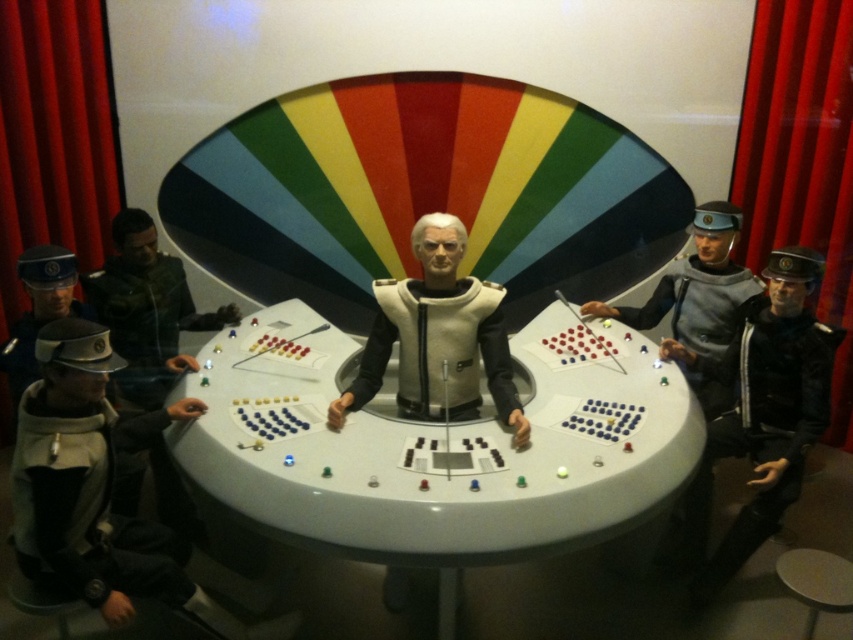
Between white plastic round table at center and metallic silver uniform at right, which one is positioned higher?

metallic silver uniform at right

Which is behind, point (448, 624) or point (724, 240)?

The point (724, 240) is more distant.

Which is in front, point (525, 476) or point (646, 307)?

Point (525, 476) is more forward.

I want to click on white plastic round table at center, so click(431, 451).

Can you confirm if light gray fabric jacket at lower left is positioned above black leather jacket at lower right?

No.

Is light gray fabric jacket at lower left smaller than black leather jacket at lower right?

Correct, light gray fabric jacket at lower left occupies less space than black leather jacket at lower right.

Is point (103, 468) positioned after point (814, 426)?

No, (103, 468) is closer to viewer.

Locate an element on the screen. This screenshot has width=853, height=640. light gray fabric jacket at lower left is located at coordinates (90, 481).

Is white matte astronaut at center taller than metallic silver uniform at right?

In fact, white matte astronaut at center may be shorter than metallic silver uniform at right.

Between white matte astronaut at center and metallic silver uniform at right, which one has less height?

Standing shorter between the two is white matte astronaut at center.

Locate an element on the screen. The width and height of the screenshot is (853, 640). white matte astronaut at center is located at coordinates (438, 339).

This screenshot has height=640, width=853. Find the location of `white matte astronaut at center`. white matte astronaut at center is located at coordinates (438, 339).